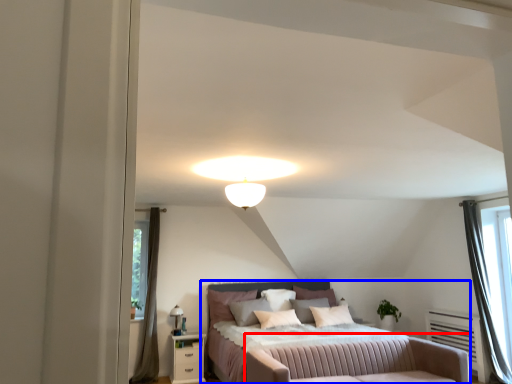
Question: Which object appears closest to the camera in this image, swivel chair (highlighted by a red box) or bed (highlighted by a blue box)?

Choices:
 (A) swivel chair
 (B) bed

Answer: (A)